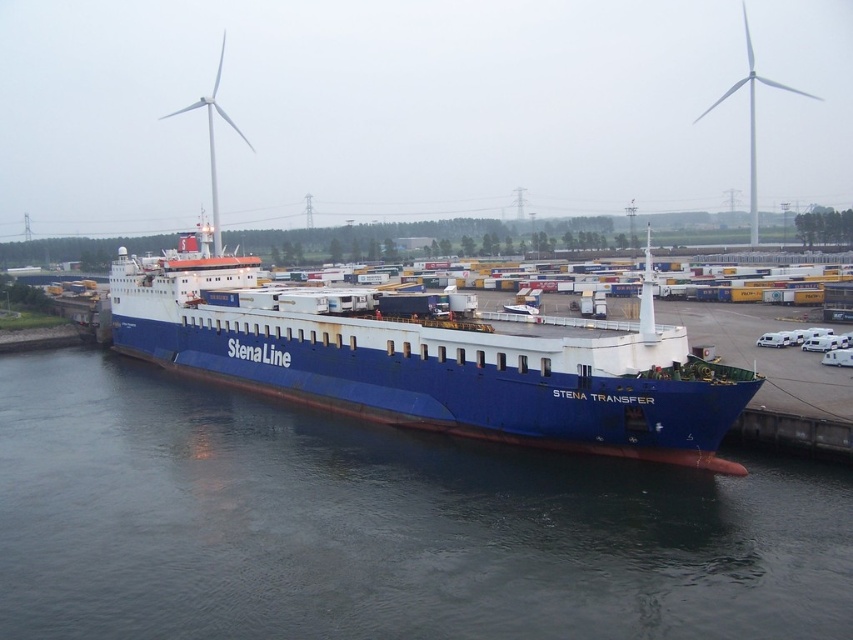
You are a photographer standing on the dock and want to capture the blue metallic water at center and the blue matte ship at center in a single photo. Considering their sizes, which object will appear smaller in the photo?

The blue metallic water at center will appear smaller in the photo because it has a smaller size compared to the blue matte ship at center.

You are a photographer trying to capture the Stena Transfer ferry from the port. You want to focus on the blue metallic water at center. Where should you position your camera to best capture this area?

Answer: To best capture the blue metallic water at center, position your camera at point (379, 525).

You are standing on the dock looking at the Stena Transfer ferry. There are two points marked on the ferry. One is at coordinates point (460,440) and the other at point (165,324). Which of these points is closer to you?

Point (460,440) is closer to the viewer than point (165,324).